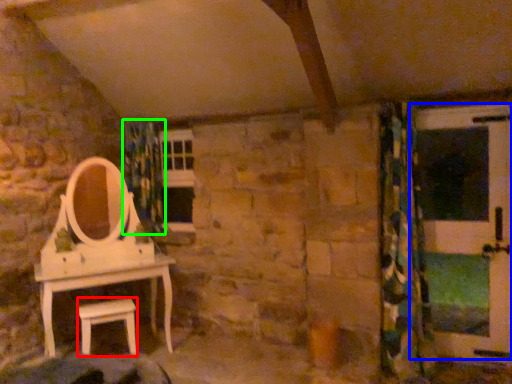
Question: Which object is the farthest from furniture (highlighted by a red box)? Choose among these: screen door (highlighted by a blue box) or shower curtain (highlighted by a green box).

Choices:
 (A) screen door
 (B) shower curtain

Answer: (A)